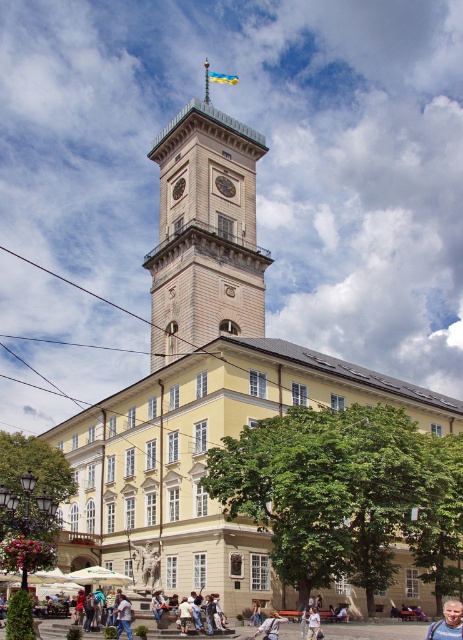
Is light blue fabric shirt at lower right taller than white cotton shirt at center?

Yes.

Is point (446, 634) less distant than point (312, 611)?

That is True.

Which is in front, point (426, 636) or point (314, 627)?

Point (314, 627) is more forward.

Identify the location of light blue fabric shirt at lower right. (448, 621).

Is blue jeans at lower center in front of golden polished clock at center?

Yes, blue jeans at lower center is in front of golden polished clock at center.

Does blue jeans at lower center appear over golden polished clock at center?

Incorrect, blue jeans at lower center is not positioned above golden polished clock at center.

Find the location of a particular element. The height and width of the screenshot is (640, 463). blue jeans at lower center is located at coordinates (123, 616).

Who is positioned more to the right, light blue fabric shirt at lower right or golden polished clock at center?

light blue fabric shirt at lower right is more to the right.

Which of these two, light blue fabric shirt at lower right or golden polished clock at center, stands taller?

light blue fabric shirt at lower right

The height and width of the screenshot is (640, 463). In order to click on light blue fabric shirt at lower right in this screenshot , I will do `click(448, 621)`.